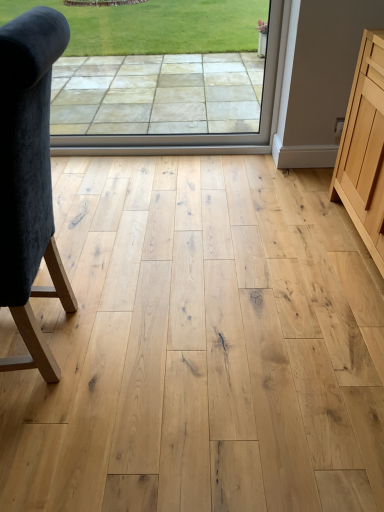
Question: Is transparent glass window at center turned away from natural wood cabinet at right?

Choices:
 (A) no
 (B) yes

Answer: (A)

Question: Can you confirm if transparent glass window at center is shorter than natural wood cabinet at right?

Choices:
 (A) no
 (B) yes

Answer: (A)

Question: From the image's perspective, does transparent glass window at center appear lower than natural wood cabinet at right?

Choices:
 (A) yes
 (B) no

Answer: (B)

Question: Is transparent glass window at center not within natural wood cabinet at right?

Choices:
 (A) yes
 (B) no

Answer: (A)

Question: From a real-world perspective, does transparent glass window at center stand above natural wood cabinet at right?

Choices:
 (A) no
 (B) yes

Answer: (B)

Question: Looking at the image, does natural wood cabinet at right seem bigger or smaller compared to transparent glass window at center?

Choices:
 (A) small
 (B) big

Answer: (B)

Question: Is point (355, 77) closer or farther from the camera than point (195, 103)?

Choices:
 (A) farther
 (B) closer

Answer: (B)

Question: Is natural wood cabinet at right wider or thinner than transparent glass window at center?

Choices:
 (A) wide
 (B) thin

Answer: (A)

Question: Considering their positions, is natural wood cabinet at right located in front of or behind transparent glass window at center?

Choices:
 (A) behind
 (B) front

Answer: (B)

Question: Considering the positions of point (223, 77) and point (342, 126), is point (223, 77) closer or farther from the camera than point (342, 126)?

Choices:
 (A) farther
 (B) closer

Answer: (A)

Question: Based on their sizes in the image, would you say transparent glass window at center is bigger or smaller than natural wood cabinet at right?

Choices:
 (A) small
 (B) big

Answer: (A)

Question: From a real-world perspective, is transparent glass window at center physically located above or below natural wood cabinet at right?

Choices:
 (A) above
 (B) below

Answer: (A)

Question: In terms of height, does transparent glass window at center look taller or shorter compared to natural wood cabinet at right?

Choices:
 (A) tall
 (B) short

Answer: (A)

Question: In the image, is transparent glass window at center positioned in front of or behind velvet dark blue chair at left?

Choices:
 (A) behind
 (B) front

Answer: (A)

Question: Considering the positions of transparent glass window at center and velvet dark blue chair at left in the image, is transparent glass window at center wider or thinner than velvet dark blue chair at left?

Choices:
 (A) thin
 (B) wide

Answer: (A)